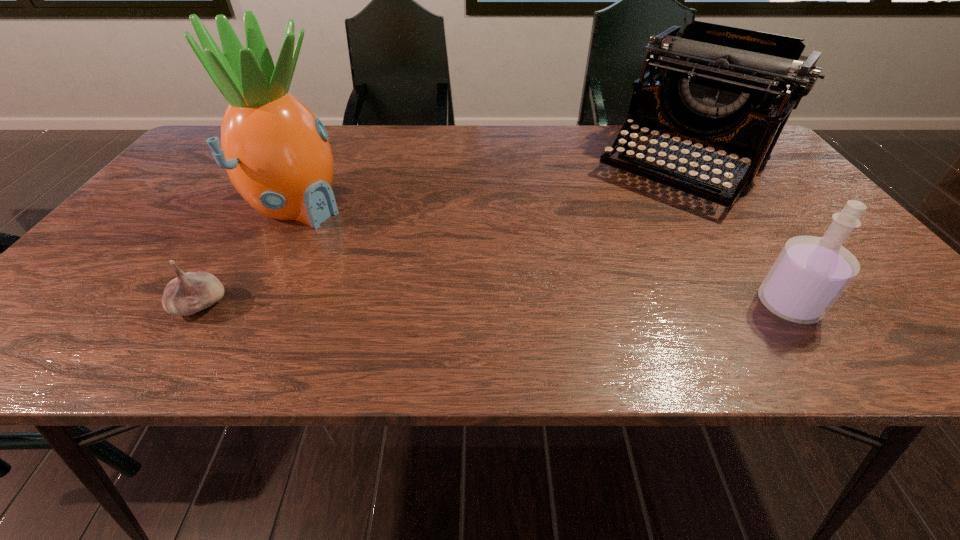
Image resolution: width=960 pixels, height=540 pixels. What are the coordinates of `free space on the desktop that is between the garlic and the second shortest object and is positioned at the entrance of the tallest object` in the screenshot? It's located at (537, 305).

At what (x,y) coordinates should I click in order to perform the action: click on vacant space on the desktop that is between the shortest object and the second shortest object and is positioned on the typing side of the typewriter. Please return your answer as a coordinate pair (x, y). Looking at the image, I should click on (557, 305).